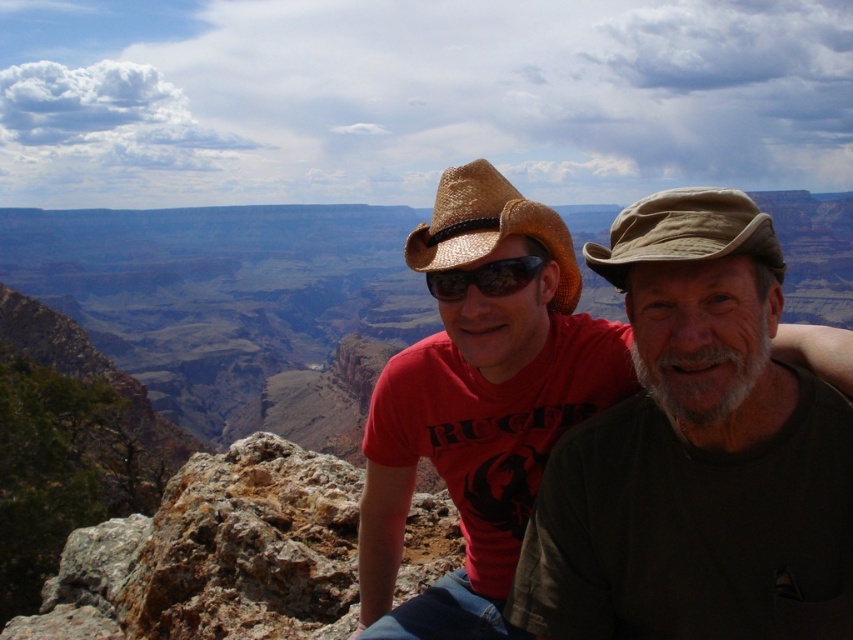
Is strawhat at center taller than matte black goggles at center?

Correct, strawhat at center is much taller as matte black goggles at center.

Which is in front, point (479, 211) or point (512, 259)?

Point (512, 259)

Who is more forward, (445, 193) or (503, 292)?

Point (503, 292) is in front.

The image size is (853, 640). I want to click on strawhat at center, so click(x=490, y=228).

Is tan fabric cowboy hat at upper right further to the viewer compared to matte black goggles at center?

No, it is in front of matte black goggles at center.

Between point (621, 262) and point (432, 282), which one is positioned in front?

Positioned in front is point (621, 262).

Locate an element on the screen. tan fabric cowboy hat at upper right is located at coordinates (685, 232).

Who is positioned more to the left, dark green fabric shirt at center or matte black goggles at center?

matte black goggles at center is more to the left.

Which of these two, dark green fabric shirt at center or matte black goggles at center, stands taller?

dark green fabric shirt at center

Does point (728, 346) come in front of point (532, 273)?

Yes, it is in front of point (532, 273).

Locate an element on the screen. dark green fabric shirt at center is located at coordinates (695, 452).